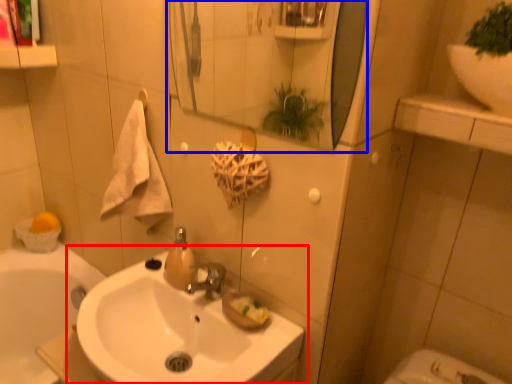
Question: Which object appears farthest to the camera in this image, sink (highlighted by a red box) or mirror (highlighted by a blue box)?

Choices:
 (A) sink
 (B) mirror

Answer: (A)